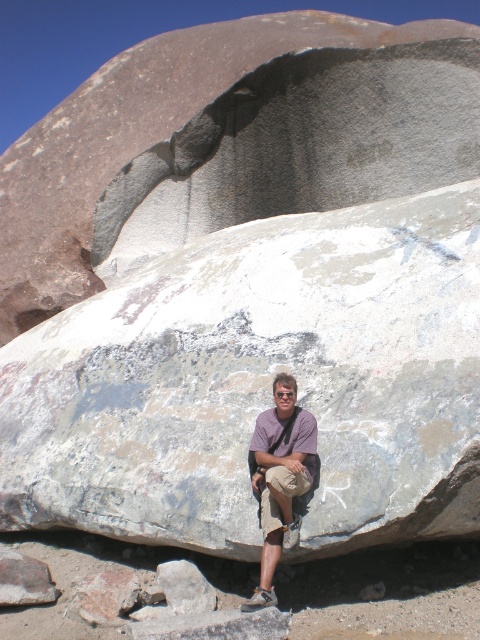
You are planning to take a photo of the purple cotton shirt at center and the khaki cotton shorts at center. Which clothing item will appear shorter in the photo?

The purple cotton shirt at center is not as tall as khaki cotton shorts at center, so it will appear shorter in the photo.

You are an outdoor photographer trying to capture the person sitting on the rock. You want to ensure that both the purple cotton shirt at center and the khaki cotton shorts at center are clearly visible in your photo. Based on their positions, which clothing item will be more visible in the foreground?

The purple cotton shirt at center is positioned over khaki cotton shorts at center, so the purple cotton shirt at center will be more visible in the foreground.

You are a photographer trying to capture the purple cotton shirt at center in your shot. Based on its 2D coordinates, where should you position your camera to ensure it is centered in the frame?

To center the purple cotton shirt at center in the frame, position your camera so that the crosshairs align with the coordinates point (280, 477).